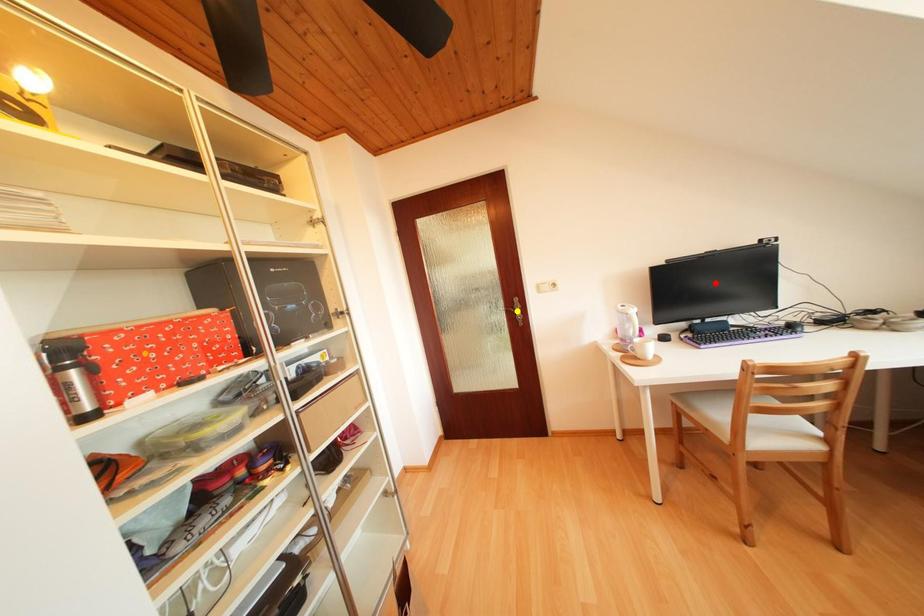
Order these from nearest to farthest:
1. yellow point
2. red point
3. orange point

1. orange point
2. red point
3. yellow point